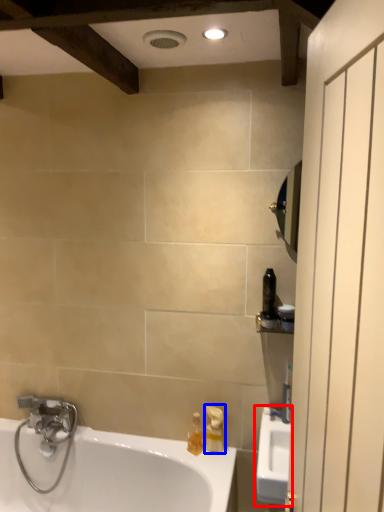
Question: Which of the following is the closest to the observer, sink (highlighted by a red box) or soap dispenser (highlighted by a blue box)?

Choices:
 (A) sink
 (B) soap dispenser

Answer: (A)